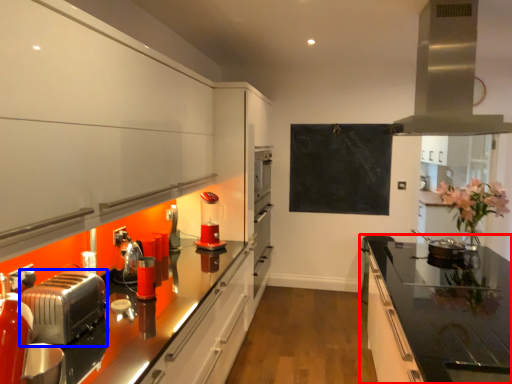
Question: Among these objects, which one is farthest to the camera, countertop (highlighted by a red box) or toaster (highlighted by a blue box)?

Choices:
 (A) countertop
 (B) toaster

Answer: (B)